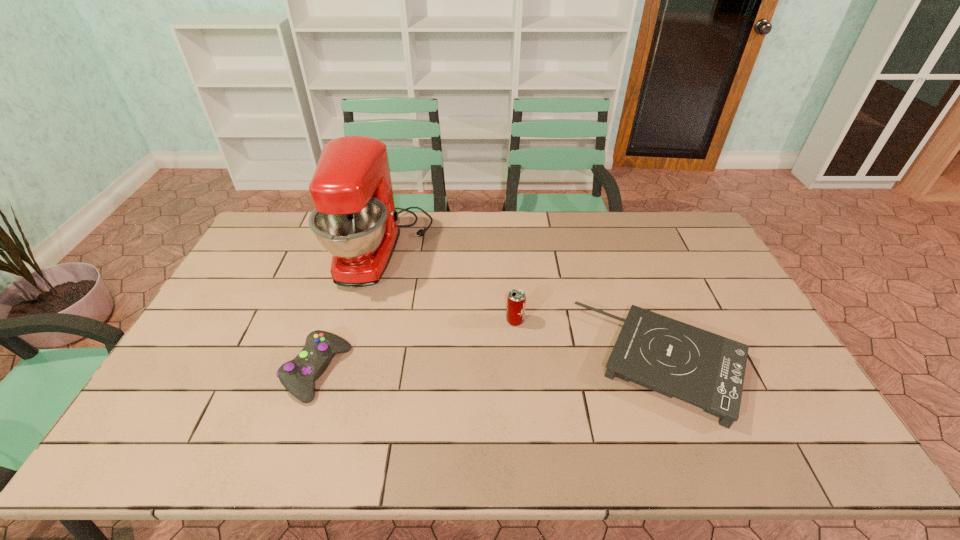
What are the coordinates of `free space that satisfies the following two spatial constraints: 1. on the back side of the control; 2. on the right side of the hotplate` in the screenshot? It's located at (320, 363).

This screenshot has height=540, width=960. I want to click on free space that satisfies the following two spatial constraints: 1. on the front-facing side of the kitchen mixer; 2. on the right side of the third object from left to right, so click(x=364, y=321).